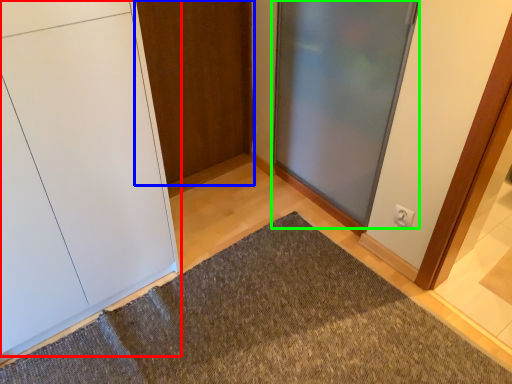
Question: Which object is the closest to the door (highlighted by a red box)? Choose among these: door (highlighted by a blue box) or door (highlighted by a green box).

Choices:
 (A) door
 (B) door

Answer: (A)